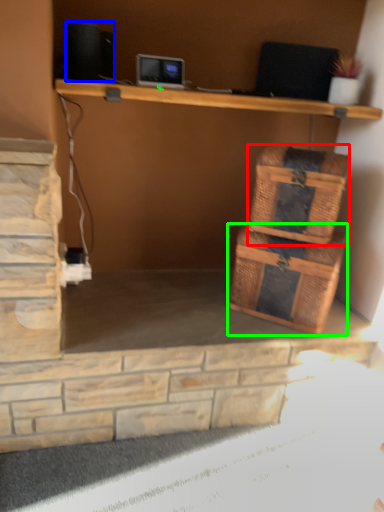
Question: Which object is positioned farthest from basket (highlighted by a red box)? Select from speaker (highlighted by a blue box) and storage box (highlighted by a green box).

Choices:
 (A) speaker
 (B) storage box

Answer: (A)